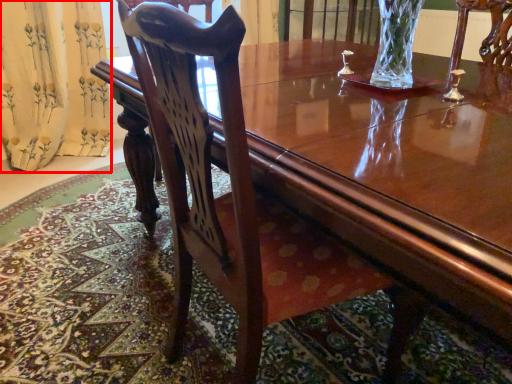
Question: From the image's perspective, what is the correct spatial positioning of curtain (annotated by the red box) in reference to chair?

Choices:
 (A) below
 (B) above

Answer: (B)